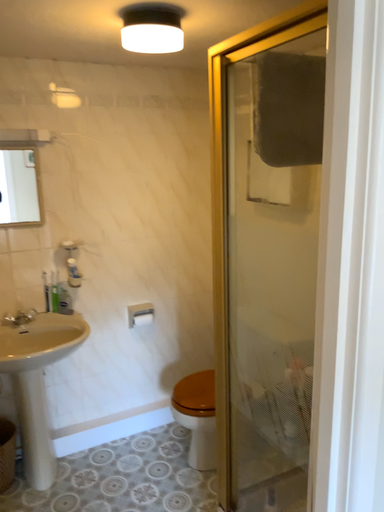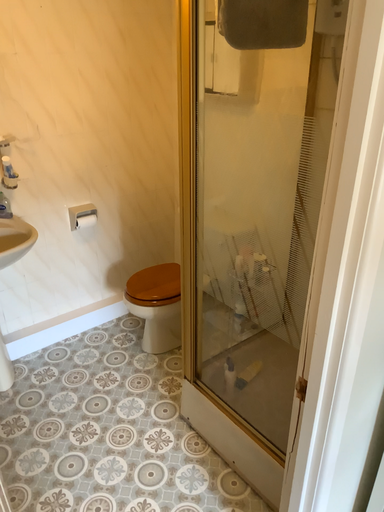
Question: How did the camera likely rotate when shooting the video?

Choices:
 (A) rotated upward
 (B) rotated downward

Answer: (B)